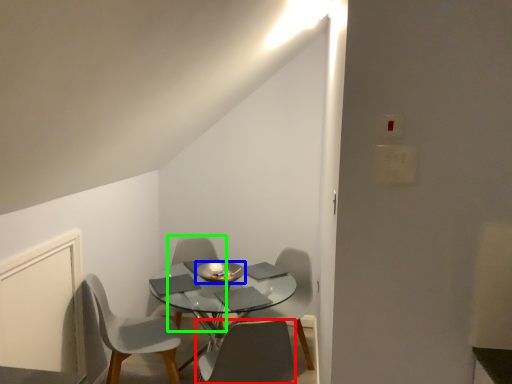
Question: Which is farther away from chair (highlighted by a red box)? bowl (highlighted by a blue box) or chair (highlighted by a green box)?

Choices:
 (A) bowl
 (B) chair

Answer: (B)